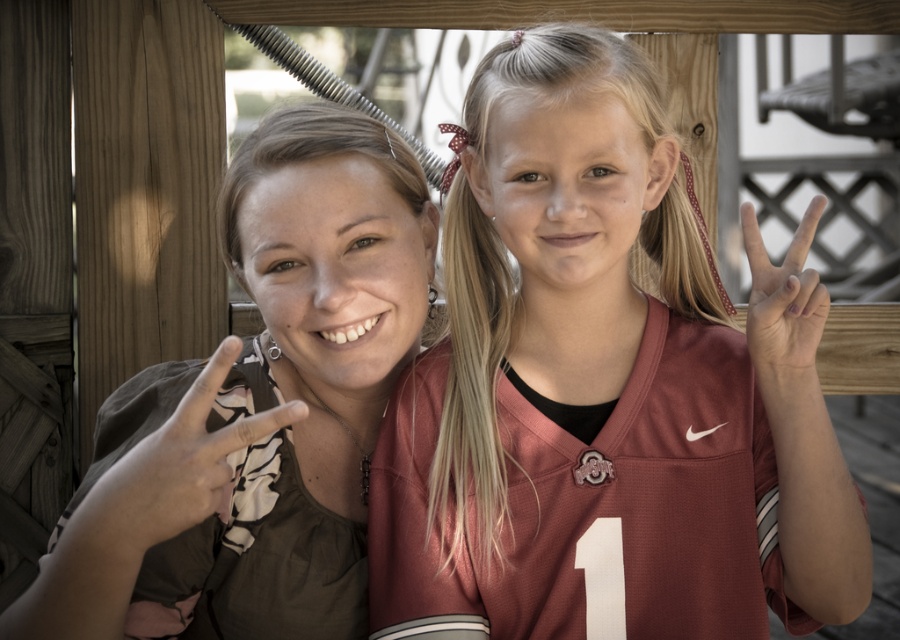
You are a photographer adjusting the camera to capture both the matte brown hand at left and the matte red jersey at right in the same frame. The camera has a fixed focal length and a field of view that can cover 24 inches. Can both objects be captured in the frame without moving the camera?

The matte brown hand at left and matte red jersey at right are 21.71 inches apart, which is less than the camera field of view of 24 inches. Therefore, both objects can be captured in the frame without moving the camera.

You are a photographer trying to capture a closeup shot of the matte brown hand at left and the matte red jersey at right. Which object should you zoom in on to ensure both are in focus without moving the camera?

The matte brown hand at left has a larger size compared to the matte red jersey at right, so you should zoom in on the matte brown hand at left to ensure both are in focus without moving the camera.

You are standing in front of the image and want to locate the matte brown shirt at left. Which quadrant of the image does it occupy?

The matte brown shirt at left is located at point (257, 412), so it is in the lower right quadrant of the image.